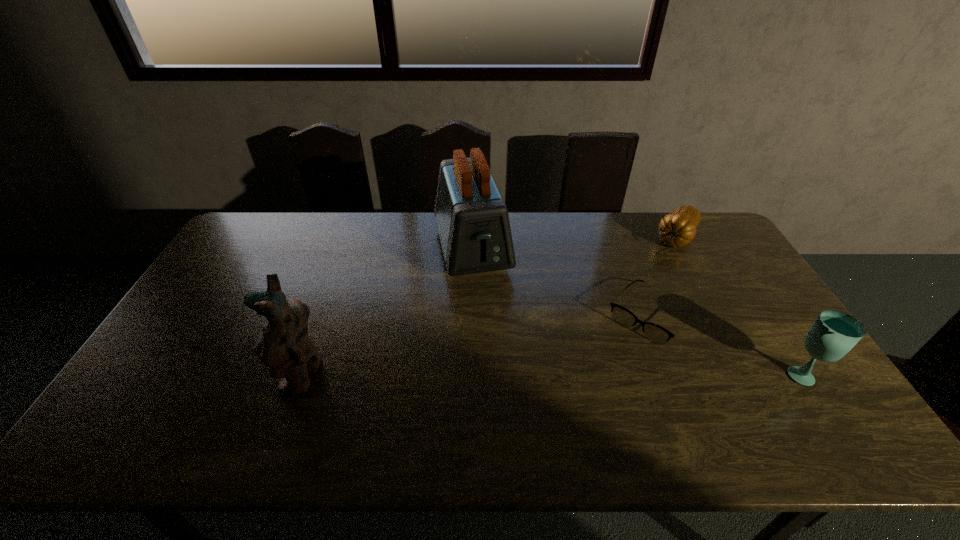
Where is `the leftmost object`? the leftmost object is located at coordinates (284, 345).

Identify the location of glass. Image resolution: width=960 pixels, height=540 pixels. (834, 333).

Find the location of a particular element. This screenshot has height=540, width=960. the rightmost object is located at coordinates (834, 333).

Identify the location of spectacles. (653, 332).

At what (x,y) coordinates should I click in order to perform the action: click on toaster. Please return your answer as a coordinate pair (x, y). This screenshot has height=540, width=960. Looking at the image, I should click on (472, 219).

You are a GUI agent. You are given a task and a screenshot of the screen. Output one action in this format:
    pyautogui.click(x=<x>, y=<y>)
    Task: Click on the fourth tallest object
    This screenshot has height=540, width=960.
    Given the screenshot: What is the action you would take?
    pyautogui.click(x=677, y=229)

This screenshot has height=540, width=960. I want to click on vacant space located 0.070m on the front-facing side of the figurine, so click(255, 375).

Where is `free location located 0.140m on the front-facing side of the figurine`? This screenshot has height=540, width=960. free location located 0.140m on the front-facing side of the figurine is located at coordinates (228, 375).

Identify the location of blank space located 0.110m on the front-facing side of the figurine. (240, 375).

Identify the location of vacant space located 0.330m on the left of the third shortest object. Image resolution: width=960 pixels, height=540 pixels. (659, 374).